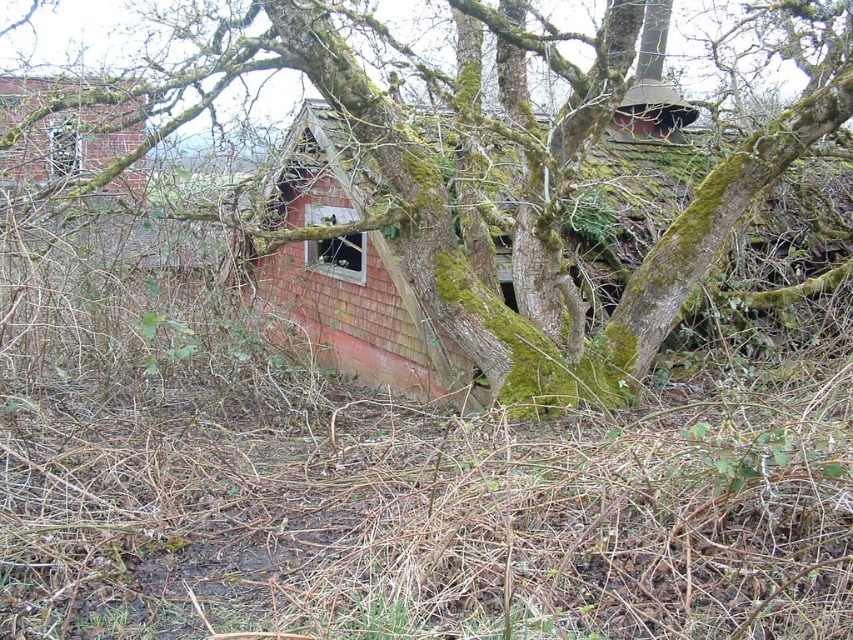
Is green mossy tree at center further to camera compared to red shingled hut at center?

No, green mossy tree at center is closer to the viewer.

Can you confirm if green mossy tree at center is taller than red shingled hut at center?

Indeed, green mossy tree at center has a greater height compared to red shingled hut at center.

You are a GUI agent. You are given a task and a screenshot of the screen. Output one action in this format:
    pyautogui.click(x=<x>, y=<y>)
    Task: Click on the green mossy tree at center
    This screenshot has height=640, width=853.
    Given the screenshot: What is the action you would take?
    pyautogui.click(x=520, y=186)

Locate an element on the screen. The height and width of the screenshot is (640, 853). green mossy tree at center is located at coordinates (520, 186).